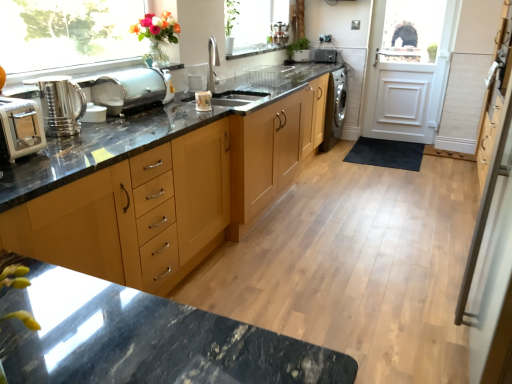
At what (x,y) coordinates should I click in order to perform the action: click on free location above white plastic toaster at left (from a real-world perspective). Please return your answer as a coordinate pair (x, y). The height and width of the screenshot is (384, 512). Looking at the image, I should click on (8, 96).